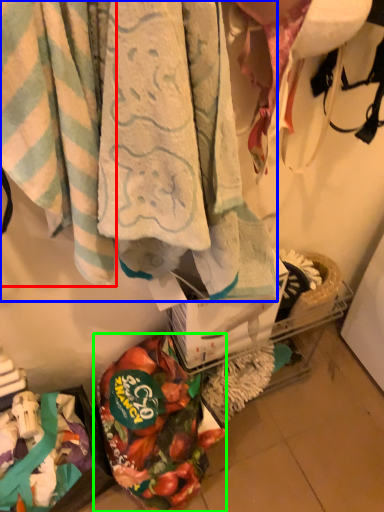
Question: Considering the real-world distances, which object is farthest from towel (highlighted by a red box)? towel (highlighted by a blue box) or food (highlighted by a green box)?

Choices:
 (A) towel
 (B) food

Answer: (B)